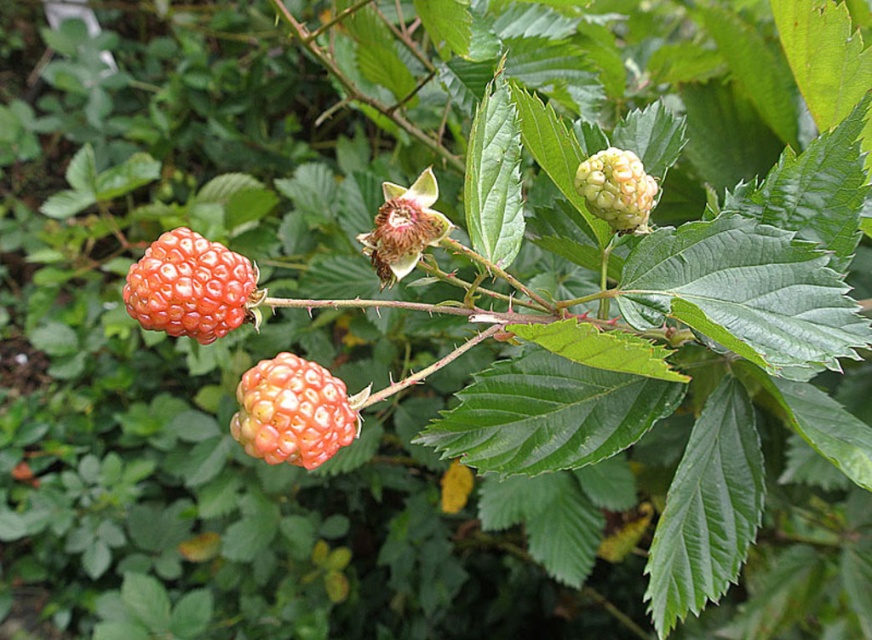
Which is in front, point (310, 365) or point (584, 161)?

Point (310, 365)

Consider the image. Is orange matte berry at center further to the viewer compared to matte yellow berry at upper right?

No, orange matte berry at center is in front of matte yellow berry at upper right.

This screenshot has width=872, height=640. Describe the element at coordinates (291, 412) in the screenshot. I see `orange matte berry at center` at that location.

Identify the location of orange matte berry at center. This screenshot has height=640, width=872. (291, 412).

Who is taller, ripe red raspberry at center or orange matte berry at center?

ripe red raspberry at center is taller.

Which is behind, point (131, 292) or point (295, 451)?

The point (131, 292) is behind.

Where is `ripe red raspberry at center`? ripe red raspberry at center is located at coordinates (192, 288).

How distant is ripe red raspberry at center from matte yellow berry at upper right?

ripe red raspberry at center is 21.61 inches away from matte yellow berry at upper right.

Is ripe red raspberry at center to the right of matte yellow berry at upper right from the viewer's perspective?

No, ripe red raspberry at center is not to the right of matte yellow berry at upper right.

Which is behind, point (157, 244) or point (586, 200)?

Positioned behind is point (586, 200).

Locate an element on the screen. This screenshot has width=872, height=640. ripe red raspberry at center is located at coordinates (192, 288).